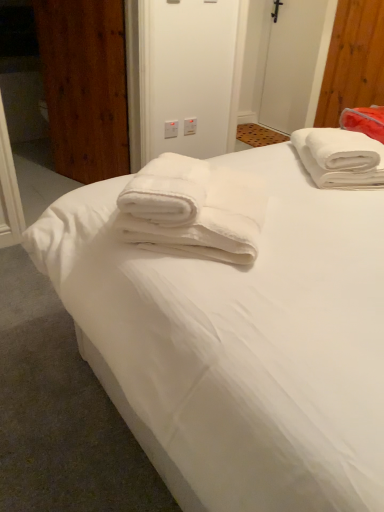
Question: In the image, is white fluffy towel at upper right, the first towel in the back-to-front sequence, on the left side or the right side of wooden door at left?

Choices:
 (A) left
 (B) right

Answer: (B)

Question: Based on their sizes in the image, would you say white fluffy towel at upper right, the 2th towel viewed from the left, is bigger or smaller than wooden door at left?

Choices:
 (A) big
 (B) small

Answer: (B)

Question: Which is nearer to the wooden door at left?

Choices:
 (A) white fluffy towel at upper right, the 2th towel viewed from the left
 (B) white plastic electric outlet at upper center, which is counted as the first electric outlet, starting from the left
 (C) white plastic screen door at upper center
 (D) white plastic electric outlet at upper center, acting as the first electric outlet starting from the right
 (E) white soft towel at center

Answer: (B)

Question: Which object is the farthest from the white fluffy towel at upper right, arranged as the second towel when viewed from the front?

Choices:
 (A) white plastic electric outlet at upper center, acting as the 2th electric outlet starting from the left
 (B) white plastic electric outlet at upper center, which is the 2th electric outlet in right-to-left order
 (C) white soft towel at center
 (D) white soft towel at upper right
 (E) white plastic screen door at upper center

Answer: (E)